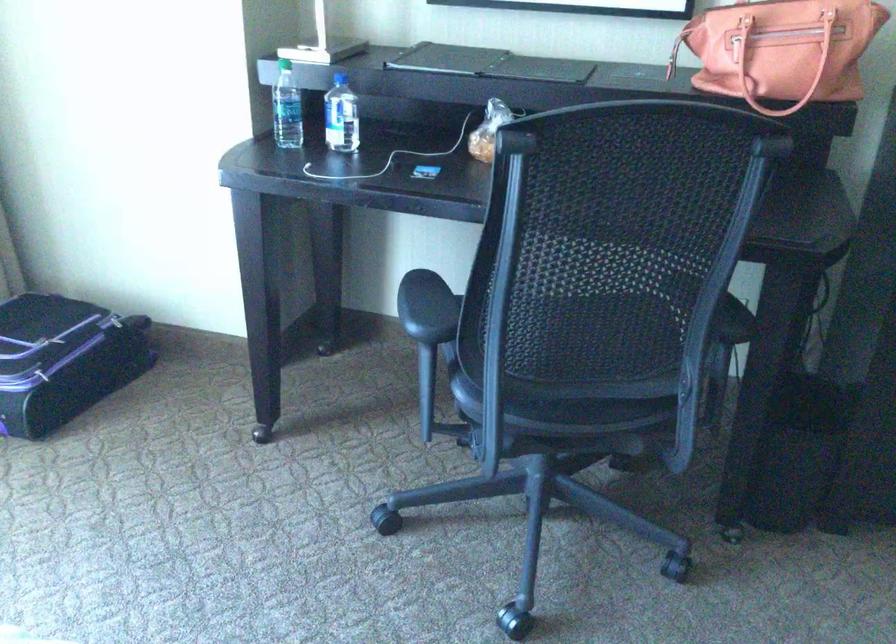
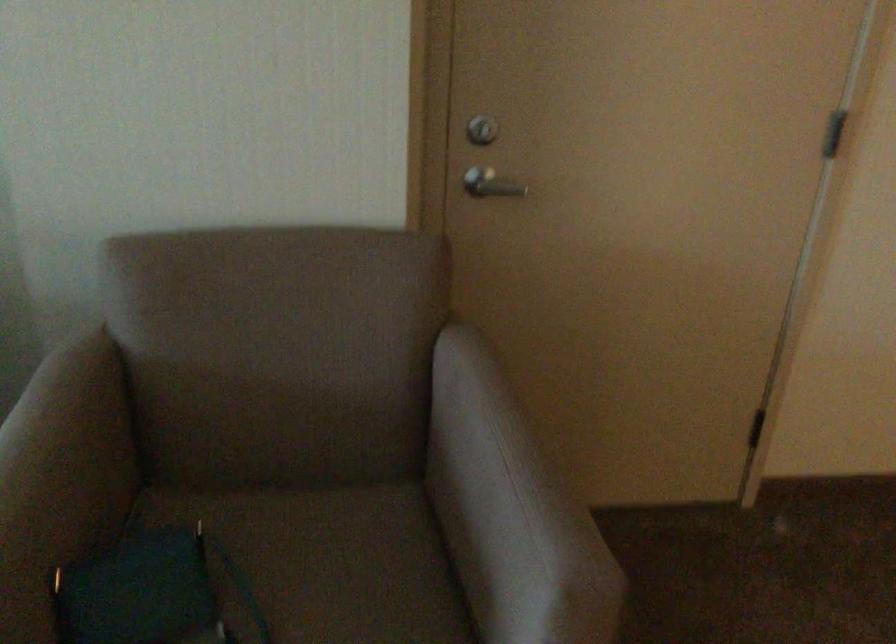
Question: In a continuous first-person perspective shot, in which direction is the camera moving?

Choices:
 (A) Left
 (B) Right
 (C) Forward
 (D) Backward

Answer: (B)